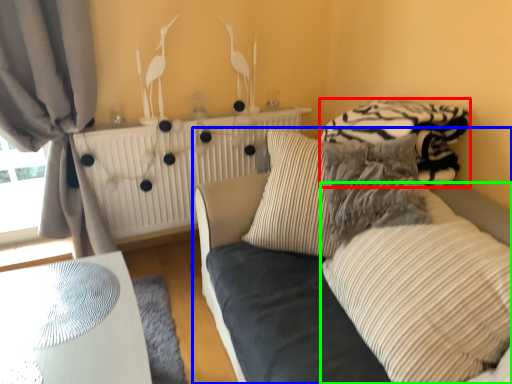
Question: Estimate the real-world distances between objects in this image. Which object is farther from bedding (highlighted by a red box), studio couch (highlighted by a blue box) or pillow (highlighted by a green box)?

Choices:
 (A) studio couch
 (B) pillow

Answer: (B)